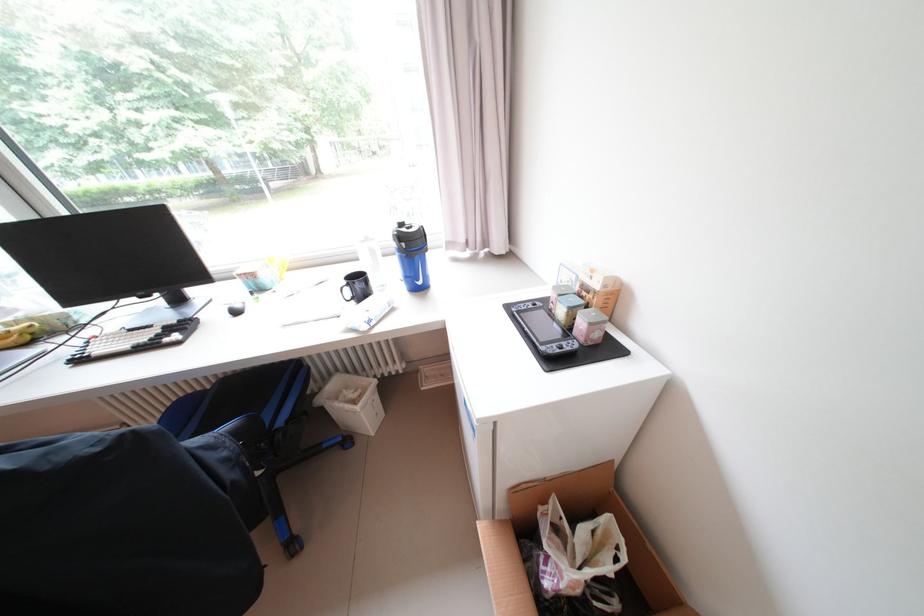
Image resolution: width=924 pixels, height=616 pixels. I want to click on black mug handle, so click(x=346, y=289).